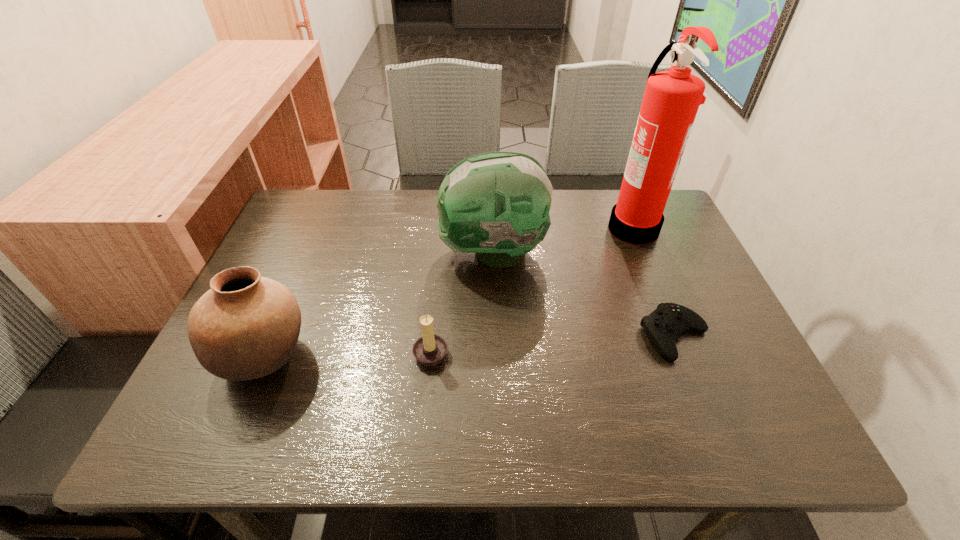
You are a GUI agent. You are given a task and a screenshot of the screen. Output one action in this format:
    pyautogui.click(x=<x>, y=<y>)
    Task: Click on the free location located 0.200m on the visor of the football helmet
    The width and height of the screenshot is (960, 540).
    Given the screenshot: What is the action you would take?
    pyautogui.click(x=363, y=252)

Identify the location of vacant region located 0.210m on the visor of the football helmet. The image size is (960, 540). (359, 252).

This screenshot has width=960, height=540. I want to click on vacant space located 0.220m on the right of the third tallest object, so click(417, 356).

Identify the location of vacant space located 0.130m on the wick of the candle holder. (510, 351).

Identify the location of vacant area situated on the left of the control. (559, 335).

Where is `fire extinguisher that is at the far edge`? The image size is (960, 540). fire extinguisher that is at the far edge is located at coordinates (671, 100).

Locate an element on the screen. The image size is (960, 540). football helmet positioned at the far edge is located at coordinates (496, 204).

This screenshot has width=960, height=540. I want to click on object that is at the left edge, so click(245, 327).

This screenshot has height=540, width=960. What are the coordinates of `fire extinguisher that is at the right edge` in the screenshot? It's located at (671, 100).

Image resolution: width=960 pixels, height=540 pixels. I want to click on control present at the right edge, so click(x=667, y=322).